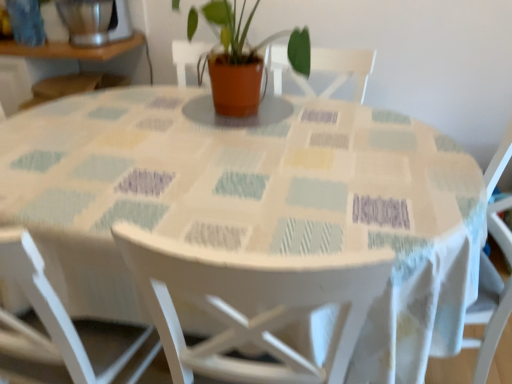
Question: Is matte terracotta pot at center completely or partially outside of brushed metal blender at upper left?

Choices:
 (A) no
 (B) yes

Answer: (B)

Question: Is matte terracotta pot at center wider than brushed metal blender at upper left?

Choices:
 (A) yes
 (B) no

Answer: (A)

Question: Does matte terracotta pot at center come behind brushed metal blender at upper left?

Choices:
 (A) yes
 (B) no

Answer: (B)

Question: From a real-world perspective, is matte terracotta pot at center positioned under brushed metal blender at upper left based on gravity?

Choices:
 (A) no
 (B) yes

Answer: (B)

Question: From the image's perspective, would you say matte terracotta pot at center is positioned over brushed metal blender at upper left?

Choices:
 (A) yes
 (B) no

Answer: (B)

Question: Is point (152, 350) closer or farther from the camera than point (173, 377)?

Choices:
 (A) farther
 (B) closer

Answer: (A)

Question: Visually, is white wood chair at lower left, arranged as the 1th chair when viewed from the left, positioned to the left or to the right of white wood chair at center, which ranks as the second chair in left-to-right order?

Choices:
 (A) right
 (B) left

Answer: (B)

Question: Would you say white wood chair at lower left, the 2th chair from the right, is inside or outside white wood chair at center, which ranks as the second chair in left-to-right order?

Choices:
 (A) inside
 (B) outside

Answer: (B)

Question: From the image's perspective, relative to white wood chair at center, the 1th chair when ordered from right to left, is white wood chair at lower left, arranged as the 1th chair when viewed from the left, above or below?

Choices:
 (A) above
 (B) below

Answer: (A)

Question: From the image's perspective, relative to matte terracotta pot at center, is white wood chair at lower left, arranged as the 1th chair when viewed from the left, above or below?

Choices:
 (A) above
 (B) below

Answer: (B)

Question: Based on their sizes in the image, would you say white wood chair at lower left, arranged as the 1th chair when viewed from the left, is bigger or smaller than matte terracotta pot at center?

Choices:
 (A) big
 (B) small

Answer: (A)

Question: Is white wood chair at lower left, the 2th chair from the right, to the left or to the right of matte terracotta pot at center in the image?

Choices:
 (A) left
 (B) right

Answer: (A)

Question: Does point (67, 357) appear closer or farther from the camera than point (244, 66)?

Choices:
 (A) closer
 (B) farther

Answer: (A)

Question: From the image's perspective, is white wood chair at center, which ranks as the second chair in left-to-right order, located above or below brushed metal blender at upper left?

Choices:
 (A) below
 (B) above

Answer: (A)

Question: Does point (132, 251) appear closer or farther from the camera than point (100, 24)?

Choices:
 (A) closer
 (B) farther

Answer: (A)